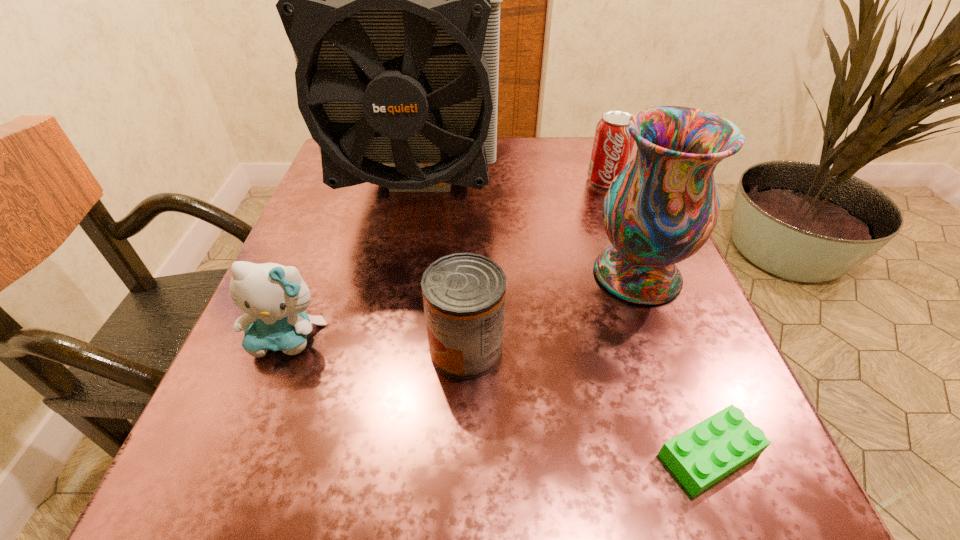
Find the location of a particular element. the tallest object is located at coordinates (391, 0).

This screenshot has width=960, height=540. Identify the location of vase. (662, 207).

Where is `the fifth shortest object`? The image size is (960, 540). the fifth shortest object is located at coordinates (662, 207).

At what (x,y) coordinates should I click in order to perform the action: click on kitten. Please return your answer as a coordinate pair (x, y). Looking at the image, I should click on (274, 297).

At what (x,y) coordinates should I click in order to perform the action: click on soda can. Please return your answer as a coordinate pair (x, y). Looking at the image, I should click on (612, 148).

You are a GUI agent. You are given a task and a screenshot of the screen. Output one action in this format:
    pyautogui.click(x=<x>, y=<y>)
    Task: Click on the can
    The height and width of the screenshot is (540, 960).
    Given the screenshot: What is the action you would take?
    pyautogui.click(x=463, y=294)

Find the location of a particular element. the nearest object is located at coordinates (701, 456).

Where is `Lego`? Lego is located at coordinates (701, 456).

Find the location of a particular element. free spot located 0.280m on the right of the tallest object is located at coordinates click(622, 183).

I want to click on free spot located 0.110m on the left of the vase, so click(x=526, y=275).